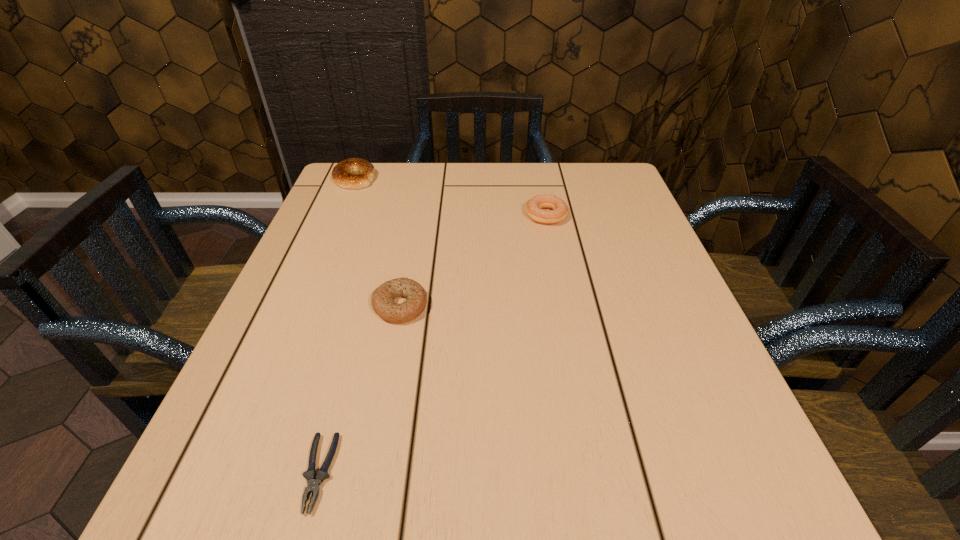
Where is `the farthest object`? the farthest object is located at coordinates (343, 174).

You are a GUI agent. You are given a task and a screenshot of the screen. Output one action in this format:
    pyautogui.click(x=<x>, y=<y>)
    Task: Click on the farthest bagel
    The image size is (960, 540).
    Given the screenshot: What is the action you would take?
    pyautogui.click(x=343, y=174)

This screenshot has width=960, height=540. I want to click on the second nearest bagel, so click(534, 206).

Image resolution: width=960 pixels, height=540 pixels. I want to click on the rightmost bagel, so click(534, 206).

The image size is (960, 540). Identify the location of the second nearest object. point(383,297).

You are a GUI agent. You are given a task and a screenshot of the screen. Output one action in this format:
    pyautogui.click(x=<x>, y=<y>)
    Task: Click on the second bagel from left to right
    The height and width of the screenshot is (540, 960).
    Given the screenshot: What is the action you would take?
    pyautogui.click(x=383, y=297)

Where is `the shortest object`? Image resolution: width=960 pixels, height=540 pixels. the shortest object is located at coordinates (313, 485).

This screenshot has width=960, height=540. In order to click on the nearest object in this screenshot , I will do click(313, 485).

Identify the location of vacant position located on the right of the farthest object. This screenshot has height=540, width=960. (480, 178).

Identify the location of free space located on the left of the second farthest object. (440, 215).